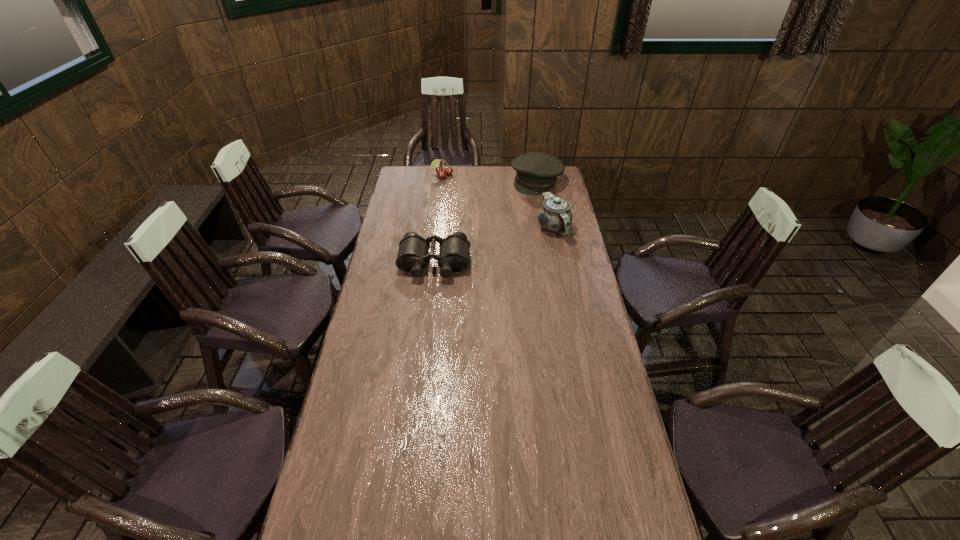
Identify which object is the nearest to the beret. Please provide its 2D coordinates. Your answer should be formatted as a tuple, i.e. [(x, y)], where the tuple contains the x and y coordinates of a point satisfying the conditions above.

[(555, 215)]

Identify which object is located as the nearest to the binoculars. Please provide its 2D coordinates. Your answer should be formatted as a tuple, i.e. [(x, y)], where the tuple contains the x and y coordinates of a point satisfying the conditions above.

[(555, 215)]